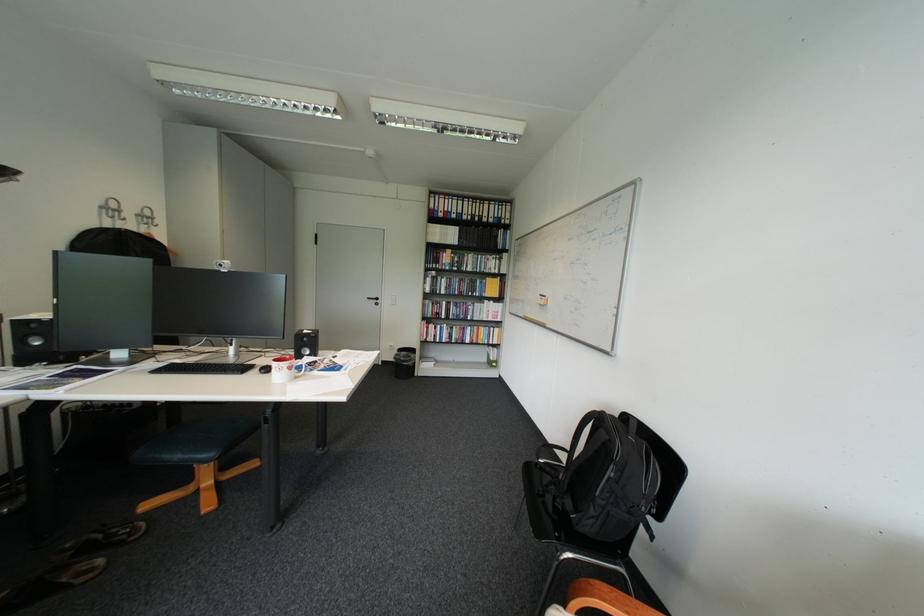
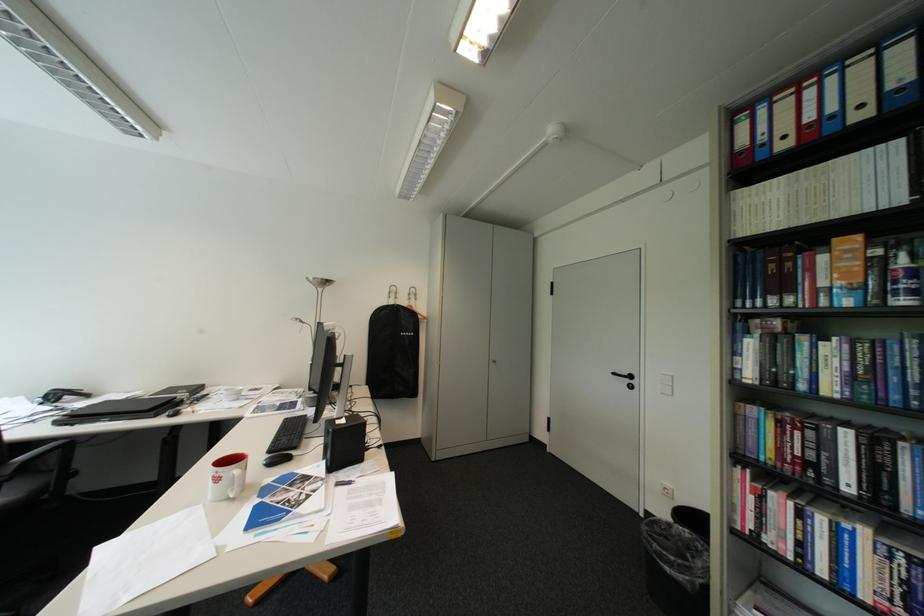
The point at (x=458, y=251) is marked in the first image. Where is the corresponding point in the second image?

(848, 240)